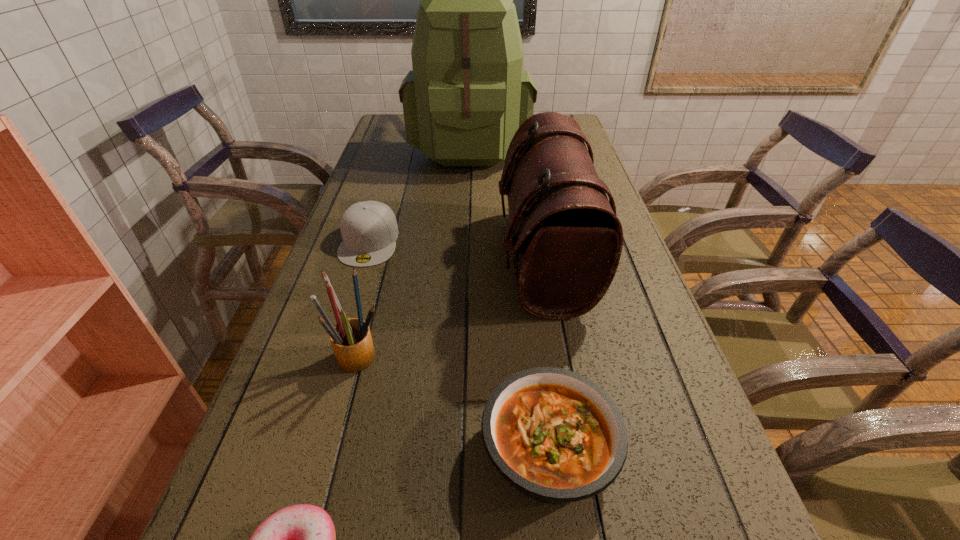
Identify the location of object that is at the far left corner. (467, 95).

Find the location of a particular element. The width and height of the screenshot is (960, 540). free space at the left edge of the desktop is located at coordinates pos(389,203).

Find the location of a particular element. The height and width of the screenshot is (540, 960). vacant space at the right edge of the desktop is located at coordinates (610, 375).

Identify the location of vacant area at the far left corner. This screenshot has width=960, height=540. (402, 116).

Identify the location of free point between the fourth shortest object and the stew. The image size is (960, 540). (455, 403).

Where is `free space that is in between the farthest object and the stew`? free space that is in between the farthest object and the stew is located at coordinates (510, 297).

At what (x,y) coordinates should I click in order to perform the action: click on empty location between the fourth farthest object and the cap. Please return your answer as a coordinate pair (x, y). This screenshot has width=960, height=540. Looking at the image, I should click on (365, 298).

Where is `unoccupied position between the fifth shortest object and the pencil box`? This screenshot has height=540, width=960. unoccupied position between the fifth shortest object and the pencil box is located at coordinates coord(452,307).

Image resolution: width=960 pixels, height=540 pixels. What are the coordinates of `vacant area that lies between the cap and the third tallest object` in the screenshot? It's located at (365, 298).

Where is `empty space between the tallest object and the satchel`? The image size is (960, 540). empty space between the tallest object and the satchel is located at coordinates (507, 201).